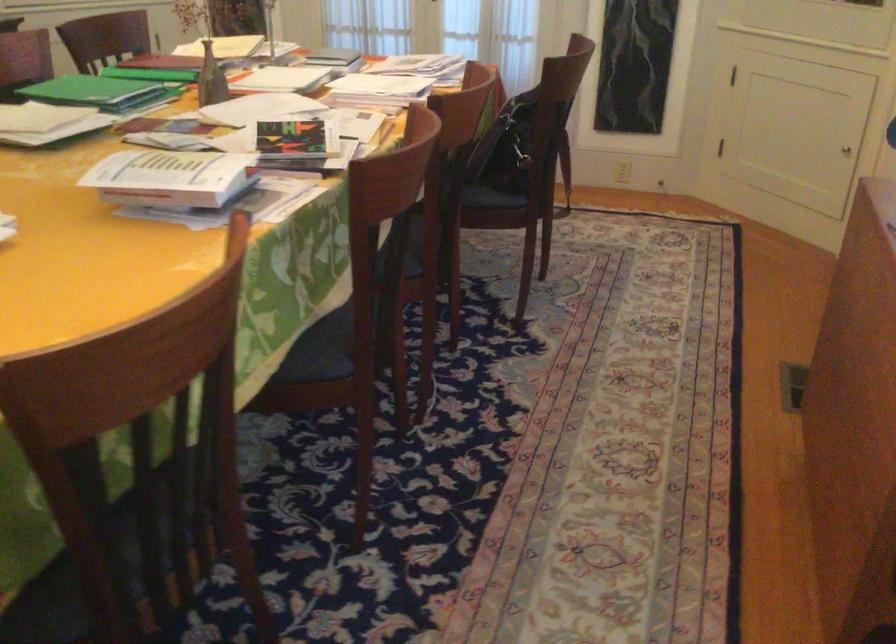
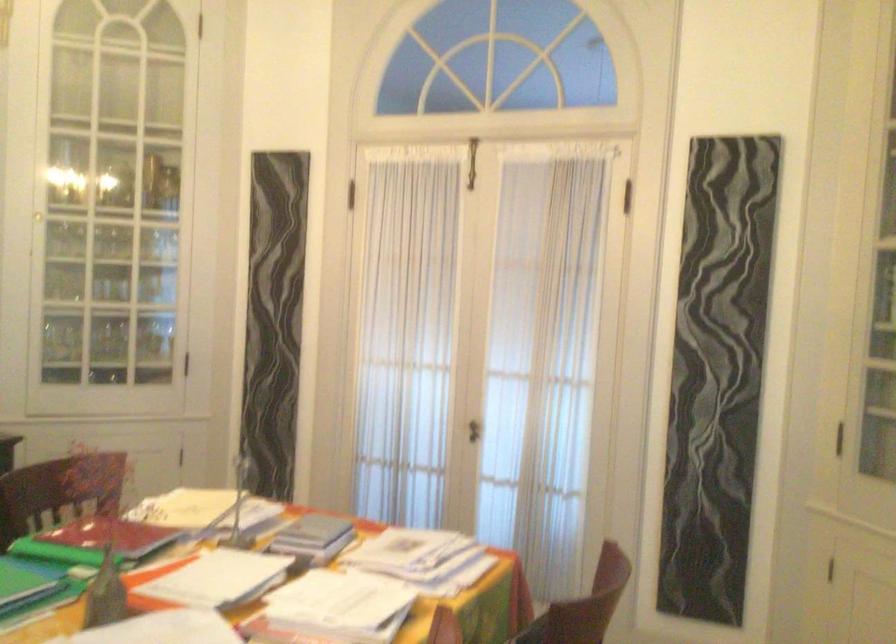
The images are taken continuously from a first-person perspective. In which direction are you moving?

The cameraman moved toward right, forward.